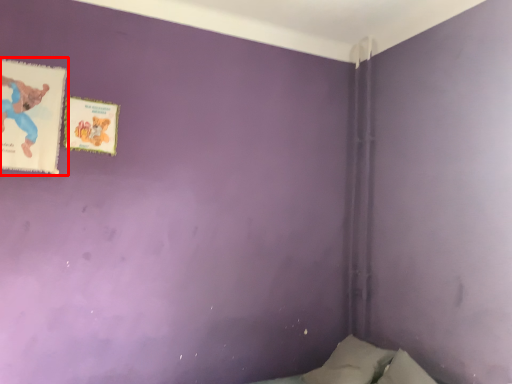
Question: Considering the relative positions of paperback book (annotated by the red box) and paperback book in the image provided, where is paperback book (annotated by the red box) located with respect to the staircase?

Choices:
 (A) left
 (B) right

Answer: (A)